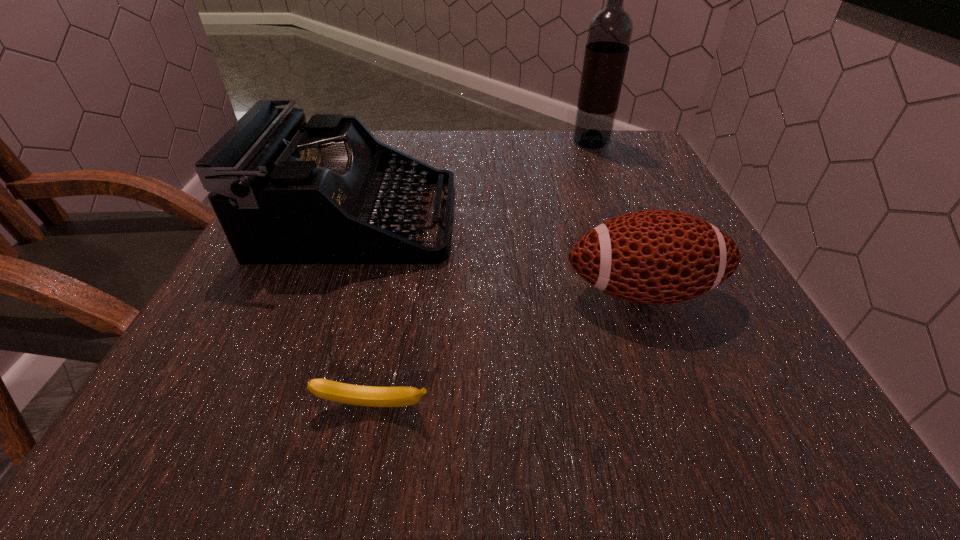
This screenshot has height=540, width=960. I want to click on wine bottle, so click(610, 31).

Locate an element on the screen. the tallest object is located at coordinates (610, 31).

Where is `typewriter`? The image size is (960, 540). typewriter is located at coordinates (285, 191).

Find the location of a particular element. The width and height of the screenshot is (960, 540). football is located at coordinates (654, 257).

Identify the location of banana. (373, 396).

This screenshot has width=960, height=540. Identify the location of the shortest object. (373, 396).

Locate an element on the screen. Image resolution: width=960 pixels, height=540 pixels. vacant space located on the front of the farthest object is located at coordinates (605, 177).

Locate an element on the screen. This screenshot has width=960, height=540. vacant space located 0.070m on the typing side of the second tallest object is located at coordinates (489, 220).

At what (x,y) coordinates should I click in order to perform the action: click on vacant position located 0.210m on the left of the second shortest object. Please return your answer as a coordinate pair (x, y). The height and width of the screenshot is (540, 960). Looking at the image, I should click on pyautogui.click(x=430, y=292).

Where is `object at the far edge`? The height and width of the screenshot is (540, 960). object at the far edge is located at coordinates [610, 31].